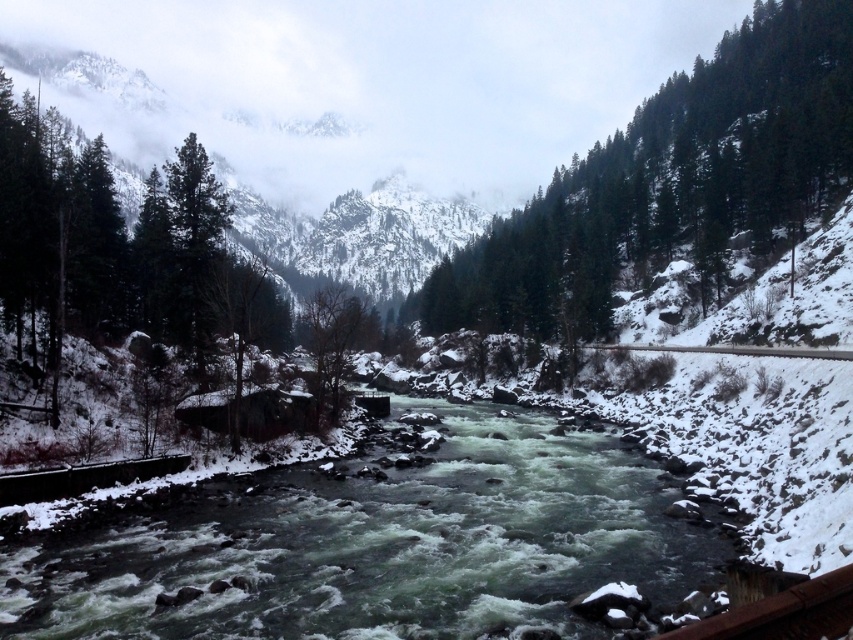
You are standing at the edge of the river in the winter landscape scene. You notice two points marked in the image. Which point, point (596, 292) or point (440, 246), is closer to you?

Point (596, 292) is closer to the viewer than point (440, 246).

You are standing at the camera position observing the winter landscape. There is a point marked at coordinates point [775,228]. Can you determine if this point is within a safe distance for taking a photograph without getting too close to the river?

The point [775,228] is 85.31 meters away from the camera, so it is a safe distance for taking a photograph without getting too close to the river.